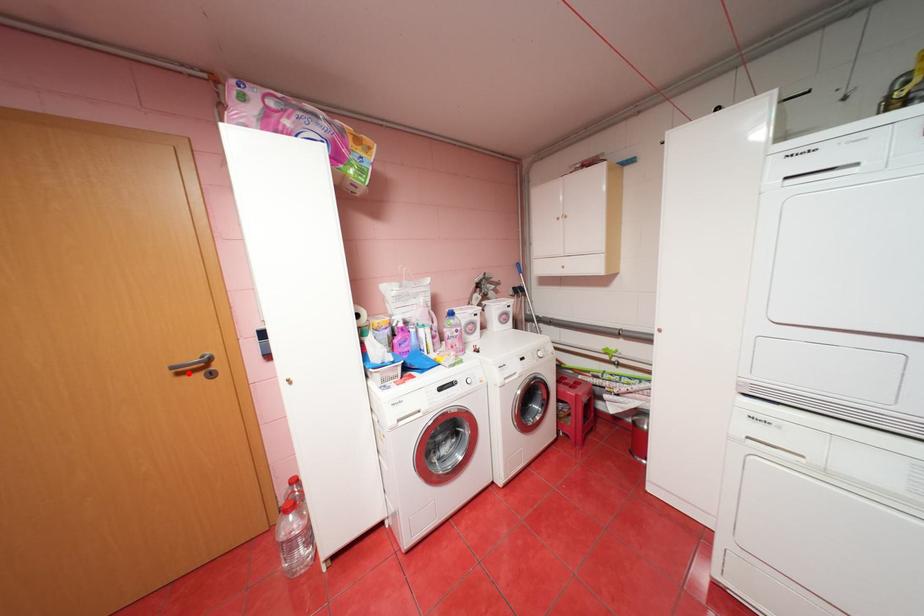
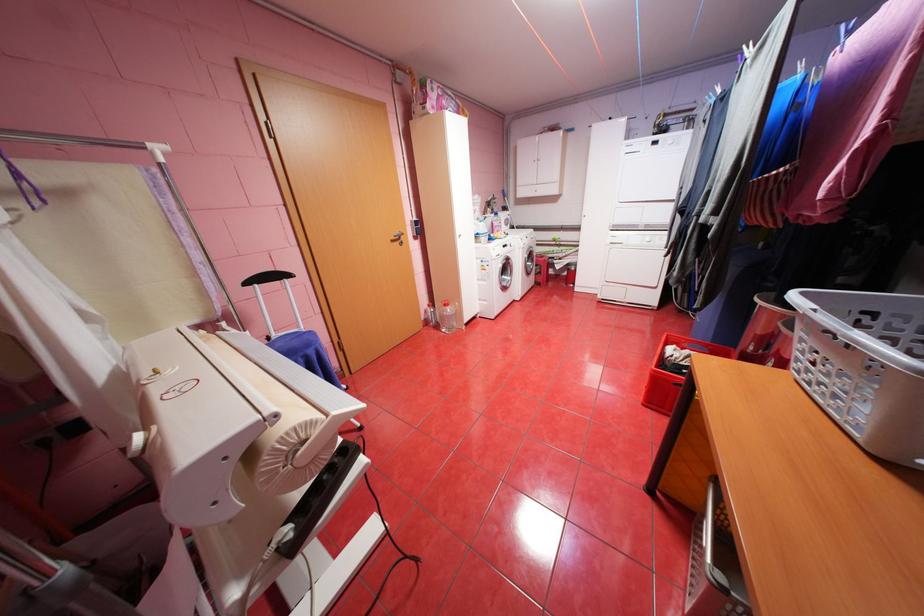
Where in the second image is the point corresponding to the highlighted location from the first image?

(400, 241)